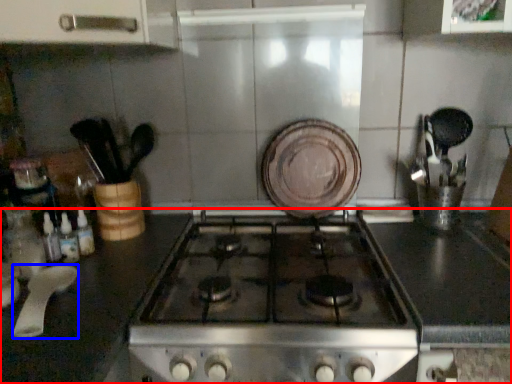
Question: Which object is closer to the camera taking this photo, countertop (highlighted by a red box) or kitchen appliance (highlighted by a blue box)?

Choices:
 (A) countertop
 (B) kitchen appliance

Answer: (A)